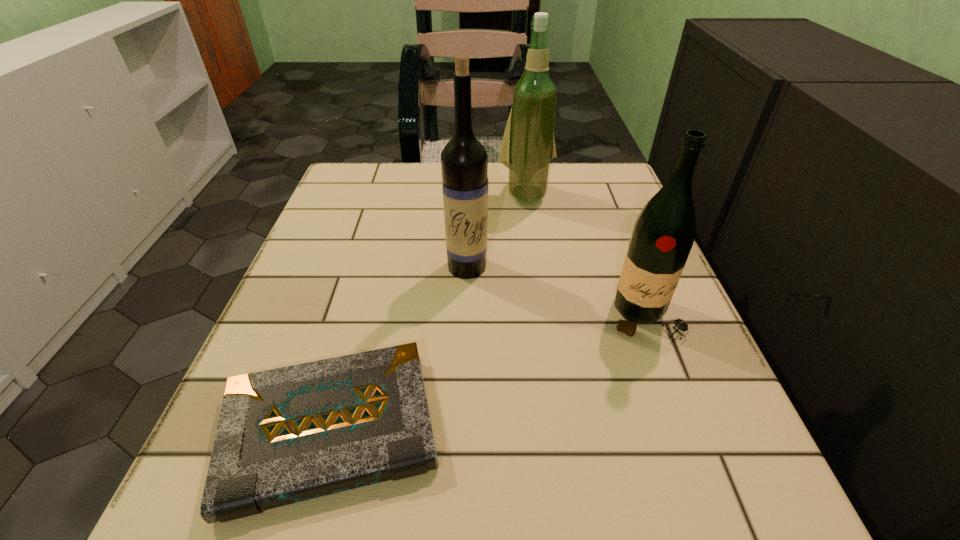
This screenshot has height=540, width=960. Find the location of `the second object from right to left`. the second object from right to left is located at coordinates point(528,145).

Where is `the farthest object`? This screenshot has height=540, width=960. the farthest object is located at coordinates (528, 145).

Where is `the third nearest object`? This screenshot has width=960, height=540. the third nearest object is located at coordinates (464, 161).

You are a GUI agent. You are given a task and a screenshot of the screen. Output one action in this format:
    pyautogui.click(x=<x>, y=<y>)
    Task: Click on the second farthest wine bottle
    Image resolution: width=960 pixels, height=540 pixels.
    Given the screenshot: What is the action you would take?
    pyautogui.click(x=464, y=161)

Locate an element on the screen. This screenshot has width=960, height=540. the second shortest object is located at coordinates coord(663,235).

Image resolution: width=960 pixels, height=540 pixels. Find the location of `the nearest wine bottle`. the nearest wine bottle is located at coordinates (663, 235).

Where is `the nearest object`? The image size is (960, 540). the nearest object is located at coordinates (290, 434).

Where is `notebook`? notebook is located at coordinates (290, 434).

Locate an element on the screen. The height and width of the screenshot is (540, 960). free point located on the front-facing side of the farthest wine bottle is located at coordinates coord(536,269).

Locate an element on the screen. Image resolution: width=960 pixels, height=540 pixels. vacant space situated 0.290m on the label of the leftmost wine bottle is located at coordinates (462, 427).